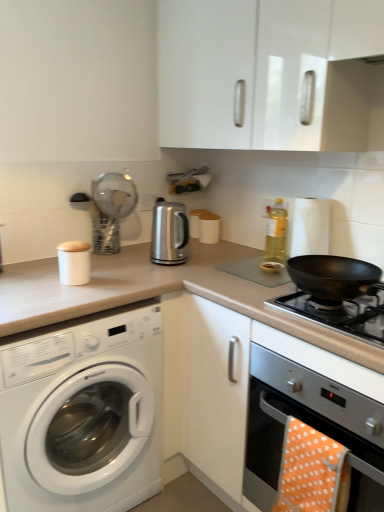
At what (x,y) coordinates should I click in order to perform the action: click on free area below satin silver kettle at center, which is counted as the 2th appliance, starting from the right (from a real-world perspective). Please return your answer as a coordinate pair (x, y). Image resolution: width=384 pixels, height=512 pixels. Looking at the image, I should click on (188, 261).